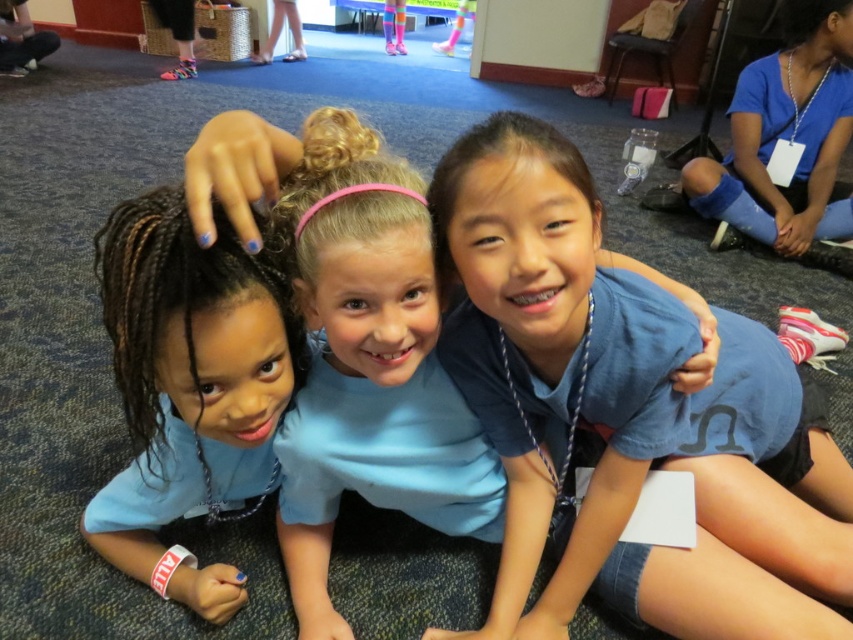
Question: Is blue cotton shirt at center behind blue matte hair at center?

Choices:
 (A) no
 (B) yes

Answer: (B)

Question: Among these points, which one is nearest to the camera?

Choices:
 (A) (345, 212)
 (B) (828, 145)
 (C) (253, 445)

Answer: (A)

Question: Which of the following is the farthest from the observer?

Choices:
 (A) (741, 96)
 (B) (234, 268)
 (C) (426, 278)

Answer: (A)

Question: Which point is closer to the camera?

Choices:
 (A) (196, 252)
 (B) (311, 236)
 (C) (798, 49)

Answer: (A)

Question: Is blue matte hair at center bigger than blue fabric leg at lower right?

Choices:
 (A) no
 (B) yes

Answer: (A)

Question: Is blue cotton shirt at center wider than blue matte hair at center?

Choices:
 (A) no
 (B) yes

Answer: (A)